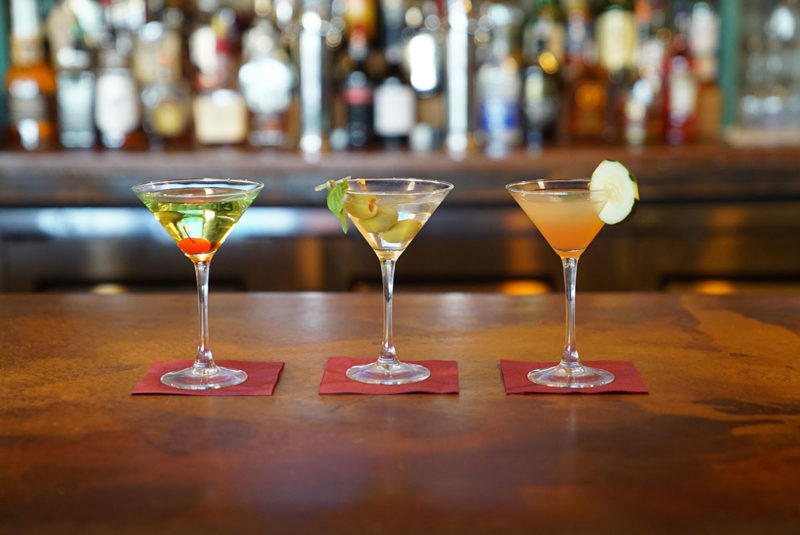
The image size is (800, 535). I want to click on napkins, so click(x=446, y=380), click(x=513, y=374), click(x=264, y=370).